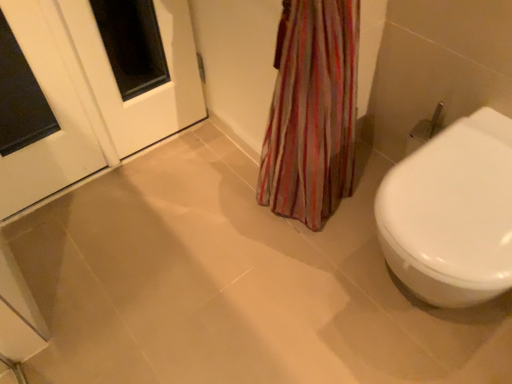
Question: In terms of width, does white glossy door at upper left look wider or thinner when compared to white glossy door at upper left?

Choices:
 (A) thin
 (B) wide

Answer: (B)

Question: Is white glossy door at upper left situated inside white glossy door at upper left or outside?

Choices:
 (A) inside
 (B) outside

Answer: (B)

Question: Based on their relative distances, which object is farther from the white glossy door at upper left?

Choices:
 (A) white glossy door at upper left
 (B) white glossy bidet at right

Answer: (B)

Question: Which object is the farthest from the white glossy door at upper left?

Choices:
 (A) white glossy bidet at right
 (B) white glossy door at upper left

Answer: (A)